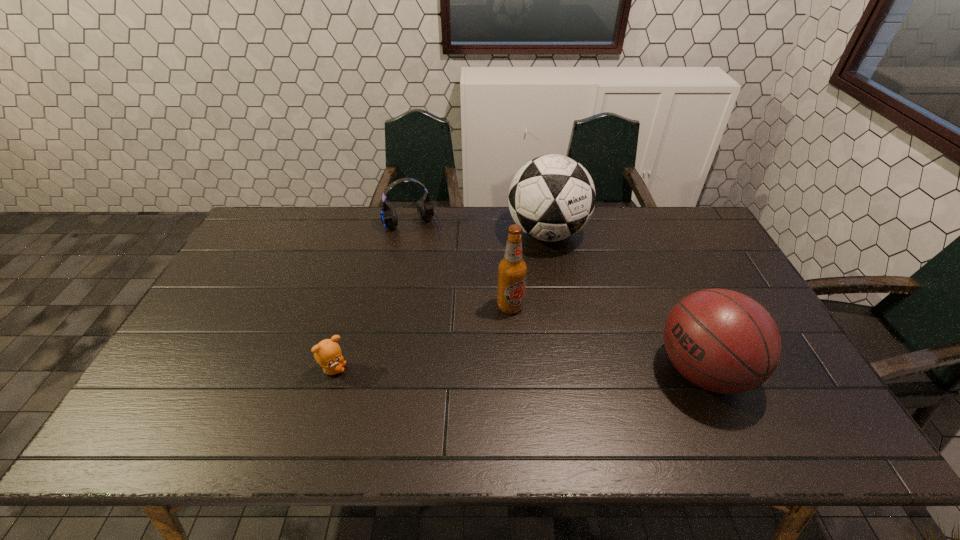
At what (x,y) coordinates should I click in order to perform the action: click on basketball present at the near edge. Please return your answer as a coordinate pair (x, y). The width and height of the screenshot is (960, 540). Looking at the image, I should click on (723, 341).

Find the location of a particular element. object that is at the right edge is located at coordinates (723, 341).

Locate an element on the screen. object located at the near right corner is located at coordinates (723, 341).

Locate an element on the screen. blank area at the far edge is located at coordinates (429, 225).

Identify the location of vacant region at the near edge of the desktop. click(741, 396).

The width and height of the screenshot is (960, 540). I want to click on free region at the left edge of the desktop, so click(212, 313).

In the image, there is a desktop. At what (x,y) coordinates should I click in order to perform the action: click on vacant space at the right edge. Please return your answer as a coordinate pair (x, y). Looking at the image, I should click on (689, 254).

Locate an element on the screen. This screenshot has height=540, width=960. free space at the far left corner of the desktop is located at coordinates (297, 212).

Locate an element on the screen. vacant space at the near left corner of the desktop is located at coordinates (227, 376).

This screenshot has width=960, height=540. I want to click on free point at the far right corner, so click(681, 239).